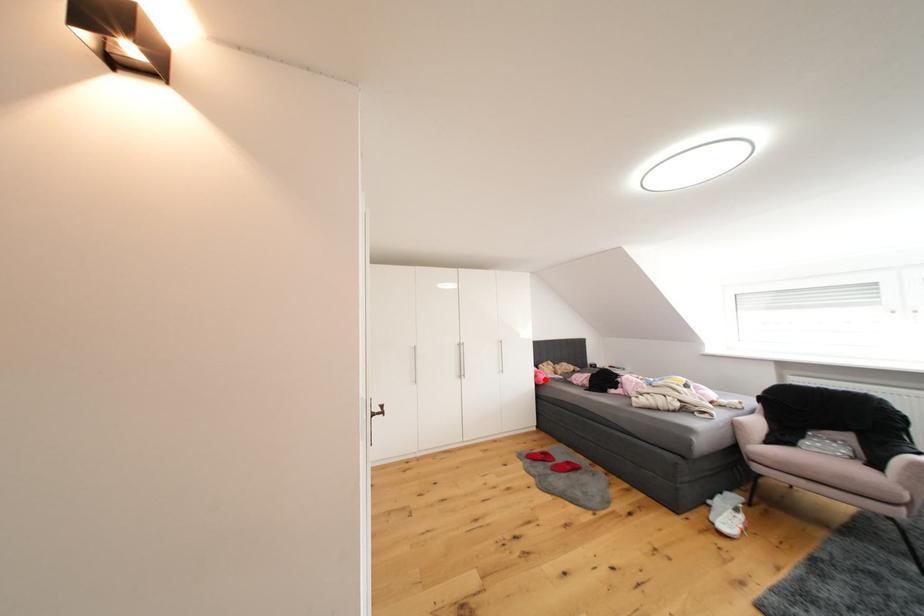
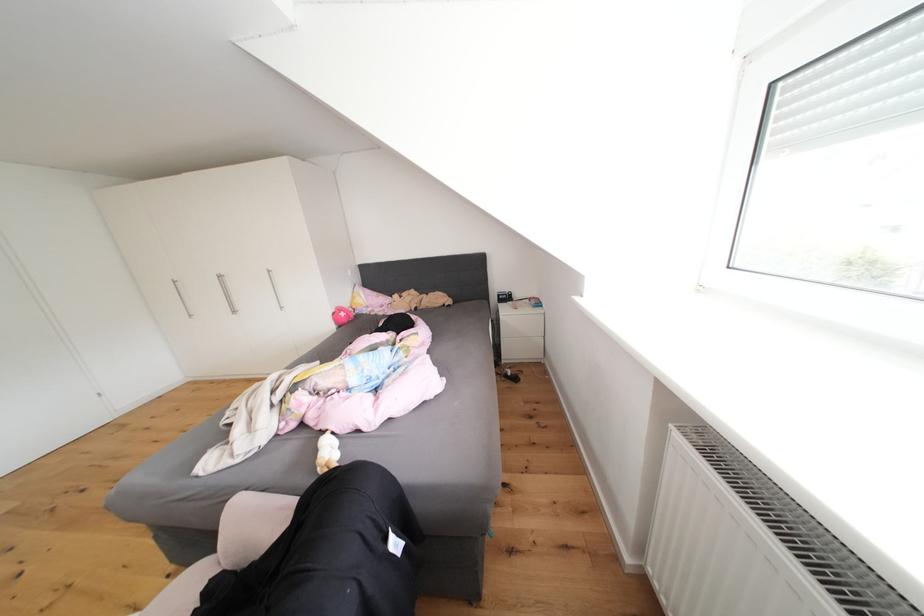
Question: I am providing you with two images of the same scene from different viewpoints. Given a red point in image1, look at the same physical point in image2. Is it:

Choices:
 (A) Closer to the viewpoint
 (B) Farther from the viewpoint

Answer: (A)